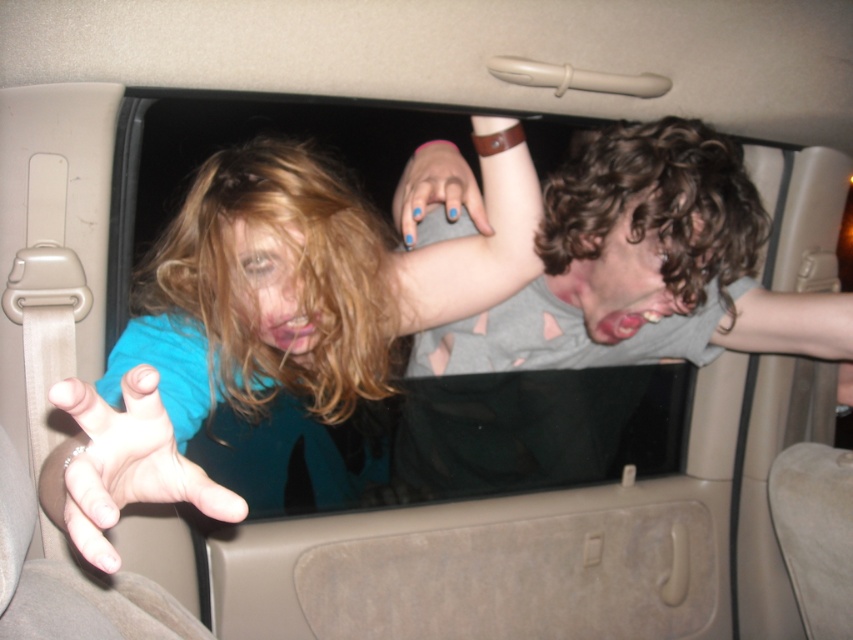
You are a driver who needs to ensure safety before starting the car. The two people in the car are at point (581, 333). Are they positioned safely for driving?

The two people in the car at point (581, 333) are 1.55 meters apart, which is a safe distance for driving.

You are a driver who needs to adjust the rearview mirror to ensure both the blue matte shirt at left and the light blue fabric hand at center are visible. Given their height difference, which object will require you to tilt the mirror upward more?

The blue matte shirt at left is much taller than the light blue fabric hand at center, so tilting the mirror upward more will be necessary to include the blue matte shirt at left in the view.

You are a passenger in the car and want to reach the gray matte shirt at upper right and the blue painted nails at upper center. Which object is closer to your hand if you extend it straight ahead from your current position?

The blue painted nails at upper center is closer to your hand because it is positioned above the gray matte shirt at upper right, which is located below it.